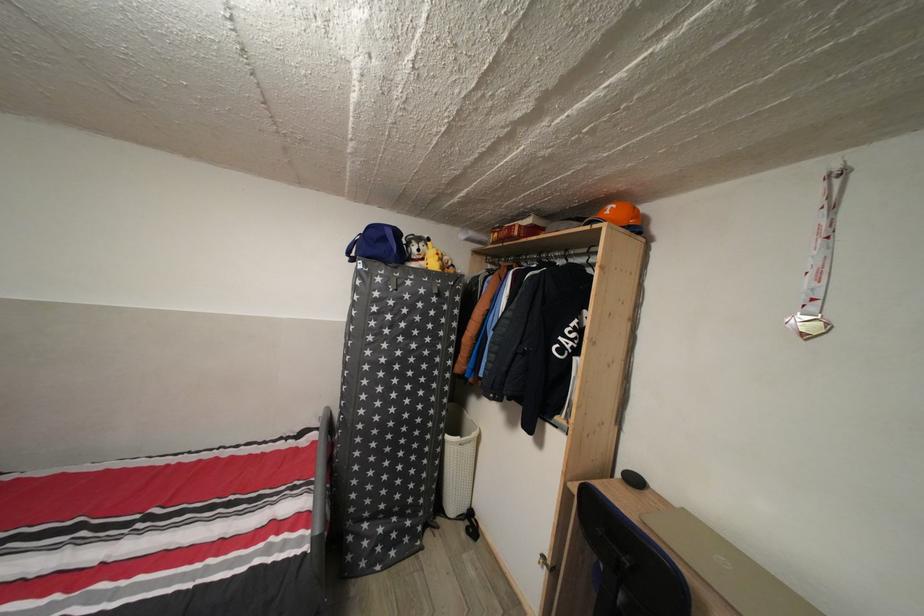
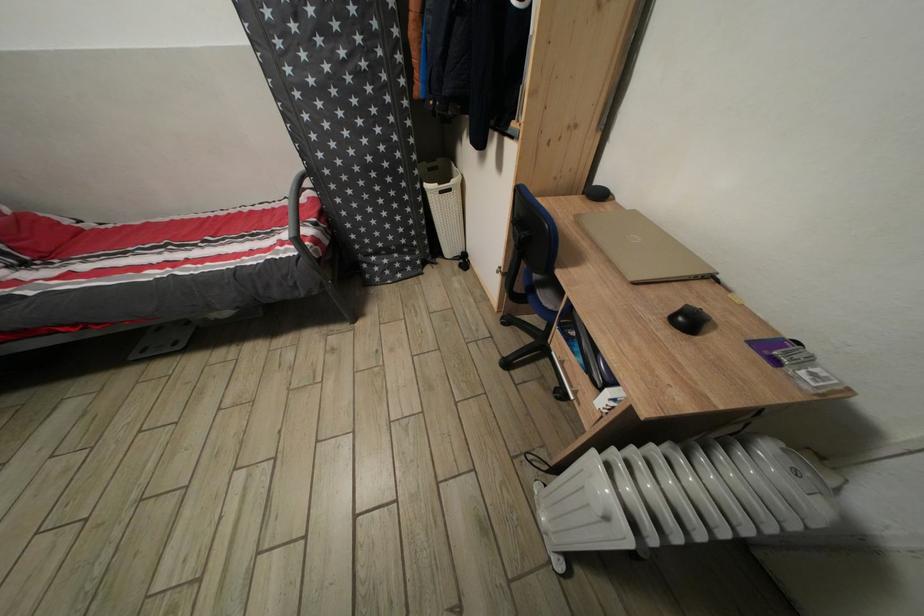
Find the pixel in the second image that matches (380,451) in the first image.

(357, 198)